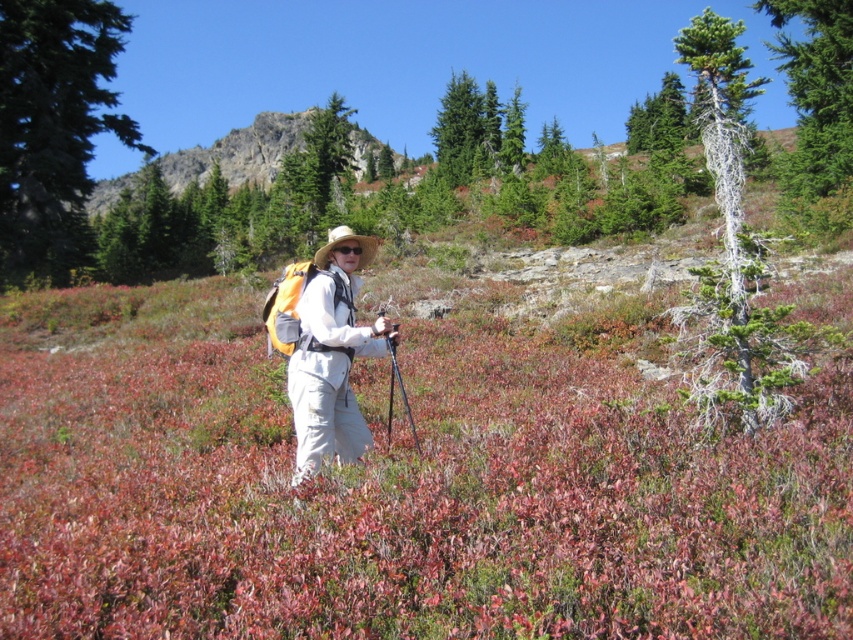
Which is more to the left, gray-green bark tree at right or green textured tree at upper right?

Positioned to the left is gray-green bark tree at right.

Which is in front, point (734, 362) or point (836, 188)?

Positioned in front is point (734, 362).

Is point (724, 349) less distant than point (802, 112)?

Yes, it is.

Locate an element on the screen. This screenshot has width=853, height=640. gray-green bark tree at right is located at coordinates (732, 244).

Is green leafy tree at left taller than green textured tree at upper right?

In fact, green leafy tree at left may be shorter than green textured tree at upper right.

Measure the distance from green leafy tree at left to green textured tree at upper right.

green leafy tree at left and green textured tree at upper right are 32.94 meters apart from each other.

Is point (65, 124) closer to camera compared to point (805, 54)?

No, (65, 124) is further to viewer.

Where is `green leafy tree at left`? green leafy tree at left is located at coordinates (53, 129).

Does gray-green bark tree at right have a lesser width compared to matte white pants at center?

In fact, gray-green bark tree at right might be wider than matte white pants at center.

Is gray-green bark tree at right smaller than matte white pants at center?

Actually, gray-green bark tree at right might be larger than matte white pants at center.

Find the location of a particular element. This screenshot has width=853, height=640. gray-green bark tree at right is located at coordinates (732, 244).